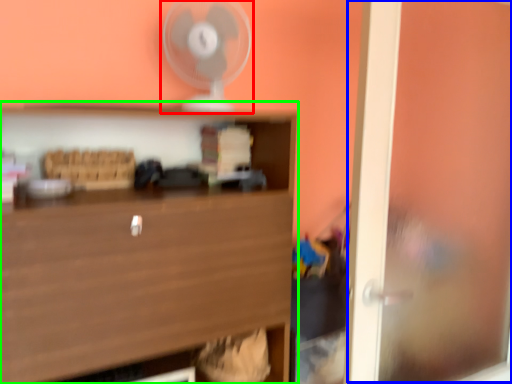
Question: Estimate the real-world distances between objects in this image. Which object is closer to fan (highlighted by a red box), window (highlighted by a blue box) or shelf (highlighted by a green box)?

Choices:
 (A) window
 (B) shelf

Answer: (B)